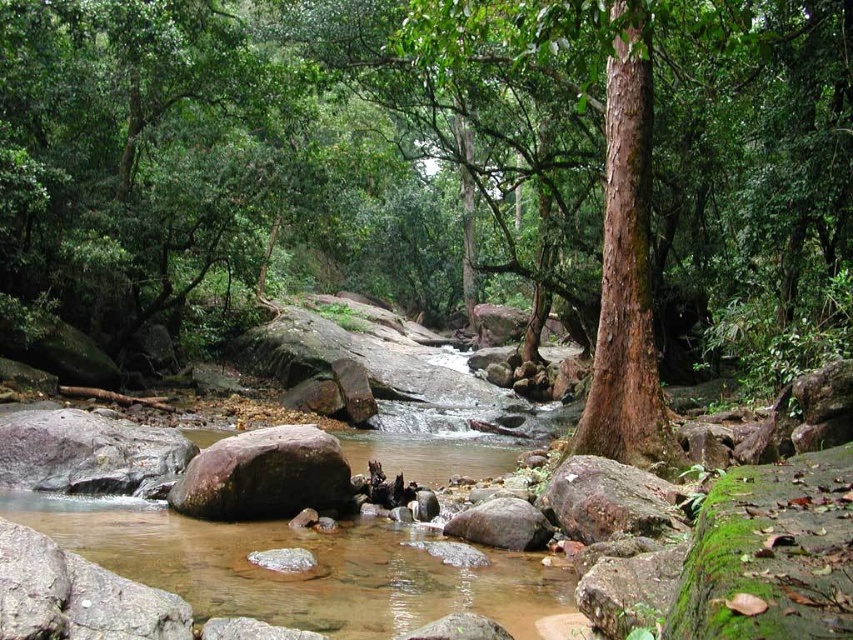
Describe the element at coordinates (434, 157) in the screenshot. This screenshot has height=640, width=853. I see `brown rough tree at center` at that location.

Find the location of a particular element. The image size is (853, 640). brown rough tree at center is located at coordinates 434,157.